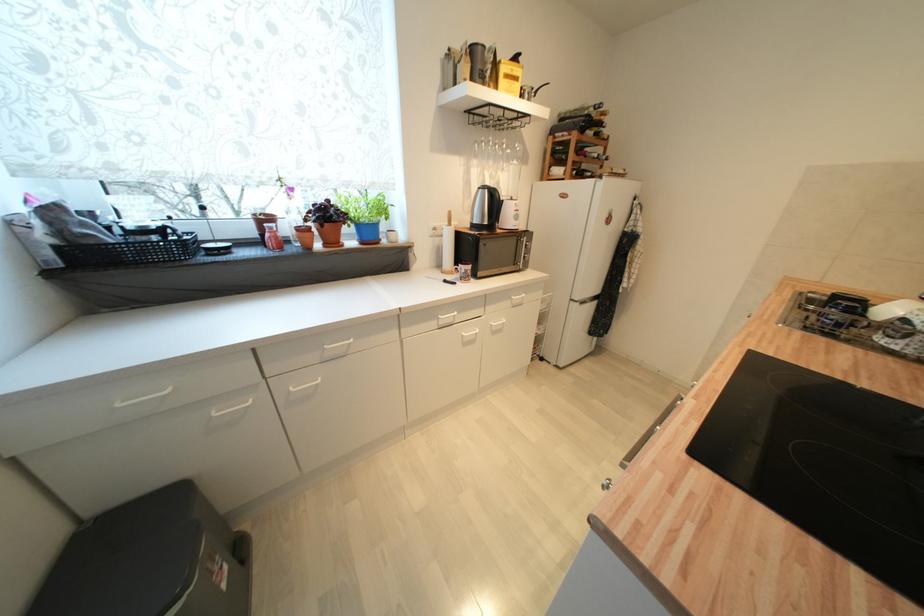
Find where to lift the trash can lid. Please return your answer as a coordinate pair (x, y).

(209, 580)